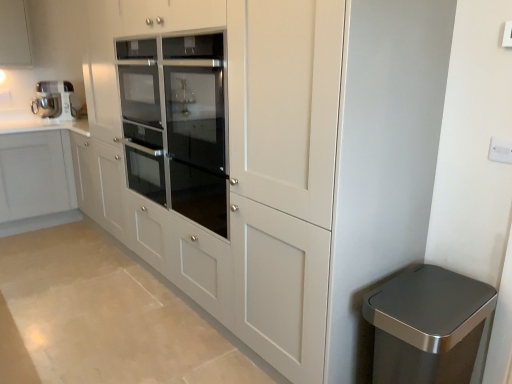
Question: Should I look upward or downward to see matte white cabinet at upper left?

Choices:
 (A) up
 (B) down

Answer: (A)

Question: Is metallic silver mixer at upper left facing away from white plastic electric outlet at upper right?

Choices:
 (A) yes
 (B) no

Answer: (B)

Question: Is metallic silver mixer at upper left bigger than white plastic electric outlet at upper right?

Choices:
 (A) yes
 (B) no

Answer: (A)

Question: From a real-world perspective, does metallic silver mixer at upper left stand above white plastic electric outlet at upper right?

Choices:
 (A) no
 (B) yes

Answer: (A)

Question: Does metallic silver mixer at upper left come behind white plastic electric outlet at upper right?

Choices:
 (A) yes
 (B) no

Answer: (A)

Question: Considering the relative positions of metallic silver mixer at upper left and white plastic electric outlet at upper right in the image provided, is metallic silver mixer at upper left to the left of white plastic electric outlet at upper right from the viewer's perspective?

Choices:
 (A) yes
 (B) no

Answer: (A)

Question: Is metallic silver mixer at upper left beside white plastic electric outlet at upper right?

Choices:
 (A) yes
 (B) no

Answer: (B)

Question: Is satin silver trash can at lower right to the right of matte white cabinet at upper left from the viewer's perspective?

Choices:
 (A) no
 (B) yes

Answer: (B)

Question: Does satin silver trash can at lower right have a lesser width compared to matte white cabinet at upper left?

Choices:
 (A) no
 (B) yes

Answer: (B)

Question: Can you confirm if satin silver trash can at lower right is positioned to the left of matte white cabinet at upper left?

Choices:
 (A) no
 (B) yes

Answer: (A)

Question: Is satin silver trash can at lower right far away from matte white cabinet at upper left?

Choices:
 (A) no
 (B) yes

Answer: (B)

Question: From the image's perspective, is satin silver trash can at lower right under matte white cabinet at upper left?

Choices:
 (A) no
 (B) yes

Answer: (B)

Question: Is satin silver trash can at lower right wider than matte white cabinet at upper left?

Choices:
 (A) yes
 (B) no

Answer: (B)

Question: Is matte white cabinet at upper left located outside white plastic electric outlet at upper right?

Choices:
 (A) yes
 (B) no

Answer: (A)